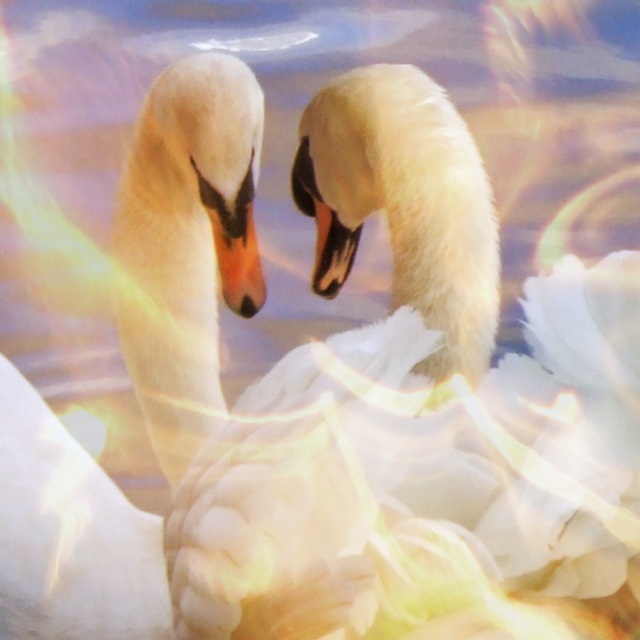
You are observing two points in the image of the swans. Which point is closer to you, point (250, 285) or point (324, 266)?

Point (250, 285) is closer to the viewer than point (324, 266).

You are a wildlife photographer aiming to capture a closeup shot of two swans interacting. You need to ensure the distance between the matte orange beak at center and the black glossy beak at center is at least 10 inches to frame them properly. Based on the scene, is the current distance sufficient?

The distance between the matte orange beak at center and the black glossy beak at center is 8.95 inches, which is less than the required 10 inches. Therefore, the current distance is insufficient for proper framing.